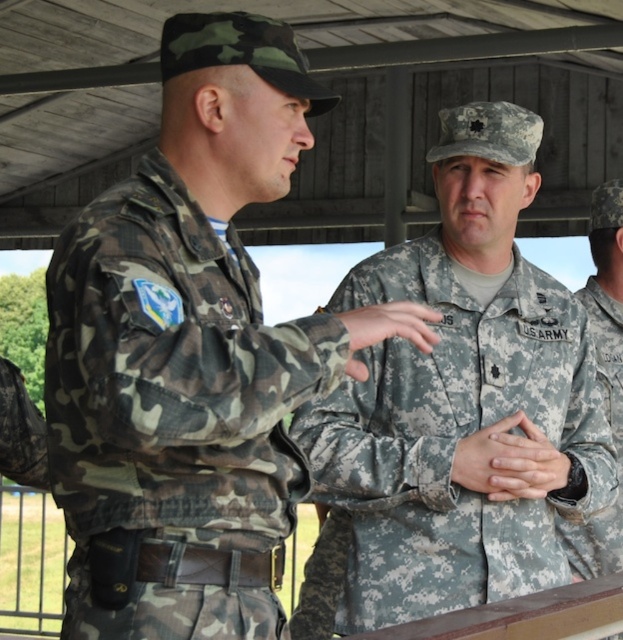
Question: Is camo fabric uniform at center bigger than camouflage fabric hands at center?

Choices:
 (A) yes
 (B) no

Answer: (A)

Question: Observing the image, what is the correct spatial positioning of camo fabric uniform at center in reference to camouflage fabric uniform at center?

Choices:
 (A) above
 (B) below

Answer: (A)

Question: Which point appears farthest from the camera in this image?

Choices:
 (A) (621, 282)
 (B) (183, 371)
 (C) (478, 456)
 (D) (492, 307)

Answer: (A)

Question: Does camouflage fabric uniform at center have a larger size compared to camouflage fabric hands at center?

Choices:
 (A) no
 (B) yes

Answer: (B)

Question: Which object appears farthest from the camera in this image?

Choices:
 (A) camouflage fabric hands at center
 (B) camo fabric uniform at center
 (C) camouflage fabric uniform at right
 (D) camouflage fabric uniform at center

Answer: (C)

Question: Which point is closer to the camera taking this photo?

Choices:
 (A) (621, 456)
 (B) (67, 596)
 (C) (381, 600)

Answer: (B)